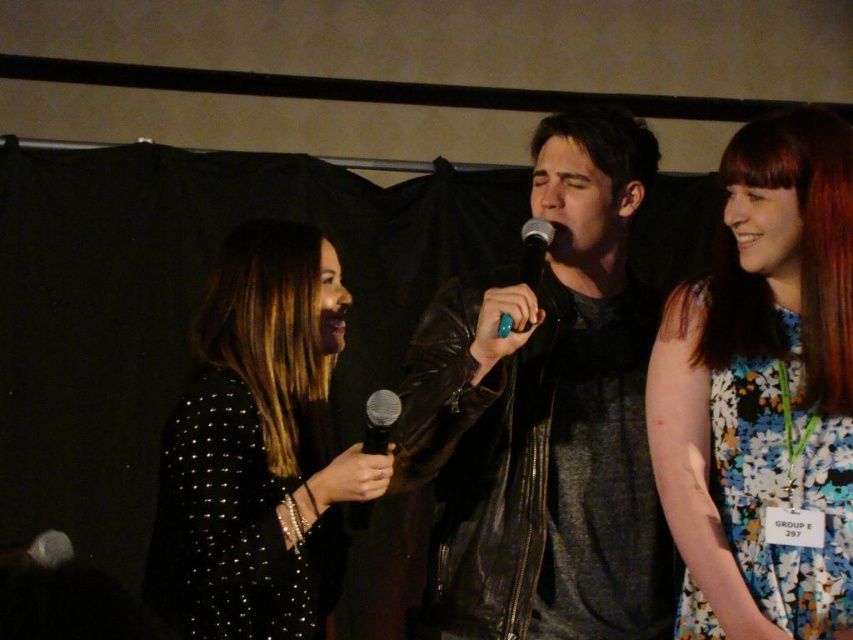
You are an event organizer who needs to ensure that the leather jacket at center and the matte black microphone at center are visible to the audience. Given their sizes, which object might require a more strategic placement to ensure visibility?

The leather jacket at center has a larger size compared to the matte black microphone at center, so the matte black microphone at center might require a more strategic placement to ensure visibility since it is smaller and could be easily overshadowed by the larger jacket.

You are an event photographer positioned at the back of the stage. You need to capture a clear photo of the matte black microphone at center without the leather jacket at center blocking it. Is this possible given their current positions?

The matte black microphone at center is behind the leather jacket at center, so it is currently blocked and cannot be seen clearly. To capture a clear photo, you would need to adjust your angle or have the subjects move so the microphone is no longer obscured.